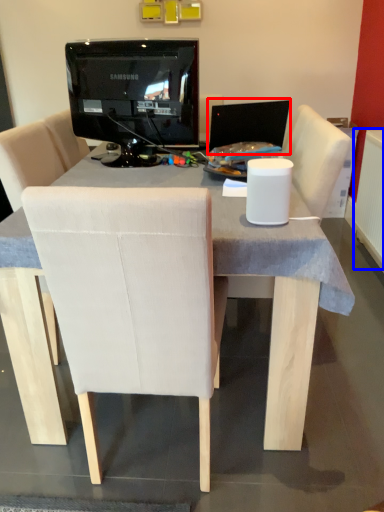
Question: Which of the following is the closest to the observer, computer monitor (highlighted by a red box) or radiator (highlighted by a blue box)?

Choices:
 (A) computer monitor
 (B) radiator

Answer: (A)